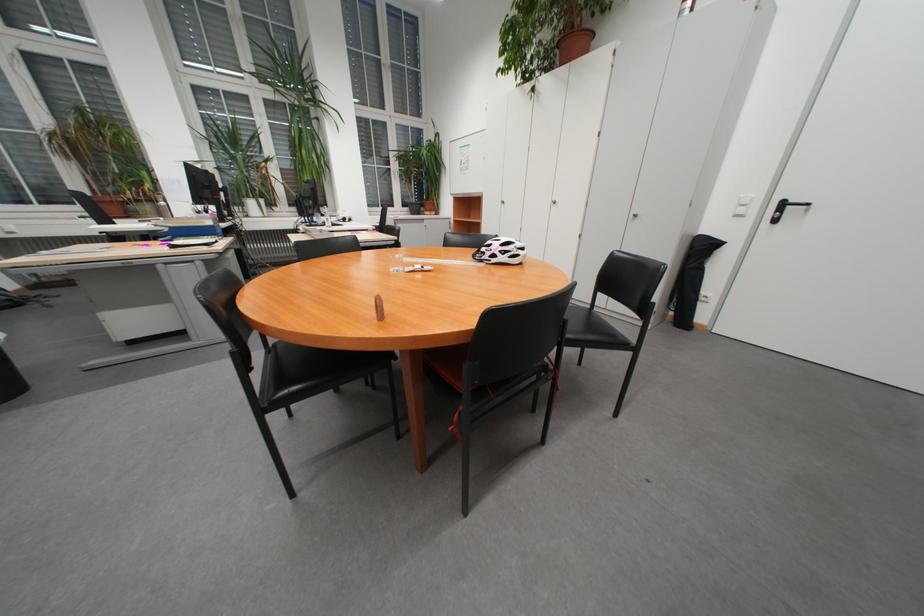
Where is `white plastic straw`? The image size is (924, 616). white plastic straw is located at coordinates (418, 268).